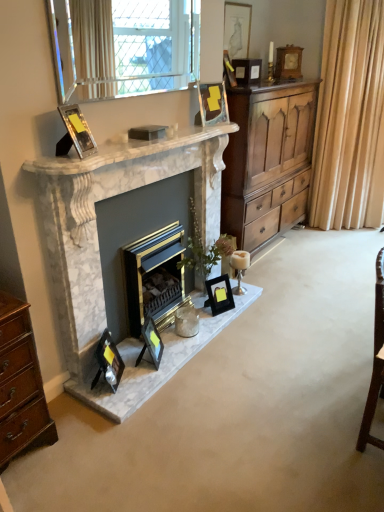
Question: Is wooden cupboard at right aimed at matte black picture frame at lower center, the 3th picture frame positioned from the left?

Choices:
 (A) yes
 (B) no

Answer: (B)

Question: From a real-world perspective, does wooden cupboard at right sit lower than matte black picture frame at lower center, the second picture frame from the bottom?

Choices:
 (A) no
 (B) yes

Answer: (A)

Question: Is wooden cupboard at right taller than matte black picture frame at lower center, the 3th picture frame positioned from the left?

Choices:
 (A) no
 (B) yes

Answer: (B)

Question: Is wooden cupboard at right to the left of matte black picture frame at lower center, which ranks as the 3th picture frame in front-to-back order, from the viewer's perspective?

Choices:
 (A) yes
 (B) no

Answer: (B)

Question: Does wooden cupboard at right have a smaller size compared to matte black picture frame at lower center, the second picture frame from the bottom?

Choices:
 (A) yes
 (B) no

Answer: (B)

Question: From the image's perspective, is wooden cupboard at right on matte black picture frame at lower center, the 6th picture frame from the top?

Choices:
 (A) no
 (B) yes

Answer: (B)

Question: Considering the relative positions of white marble fireplace at upper center and matte black picture frame at lower center, the 6th picture frame from the top, in the image provided, is white marble fireplace at upper center behind matte black picture frame at lower center, the 6th picture frame from the top,?

Choices:
 (A) no
 (B) yes

Answer: (A)

Question: From a real-world perspective, is white marble fireplace at upper center physically below matte black picture frame at lower center, the 6th picture frame from the top?

Choices:
 (A) yes
 (B) no

Answer: (B)

Question: Could matte black picture frame at lower center, the 3th picture frame positioned from the left, be considered to be inside white marble fireplace at upper center?

Choices:
 (A) yes
 (B) no

Answer: (B)

Question: Can you confirm if white marble fireplace at upper center is bigger than matte black picture frame at lower center, the second picture frame from the bottom?

Choices:
 (A) no
 (B) yes

Answer: (B)

Question: Is white marble fireplace at upper center at the right side of matte black picture frame at lower center, the 6th picture frame from the top?

Choices:
 (A) no
 (B) yes

Answer: (B)

Question: Is white marble fireplace at upper center positioned with its back to matte black picture frame at lower center, the 3th picture frame positioned from the left?

Choices:
 (A) no
 (B) yes

Answer: (A)

Question: Is white marble fireplace at upper center smaller than white glass candle holder at lower center?

Choices:
 (A) no
 (B) yes

Answer: (A)